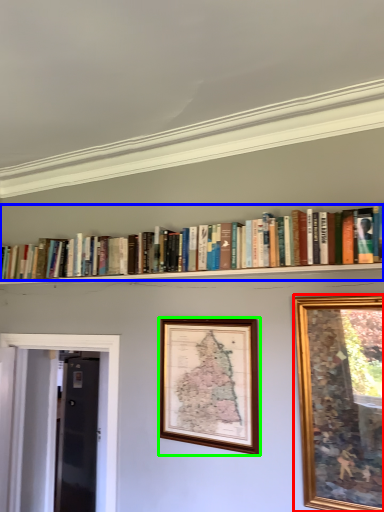
Question: Which is farther away from picture frame (highlighted by a red box)? book (highlighted by a blue box) or picture frame (highlighted by a green box)?

Choices:
 (A) book
 (B) picture frame

Answer: (A)